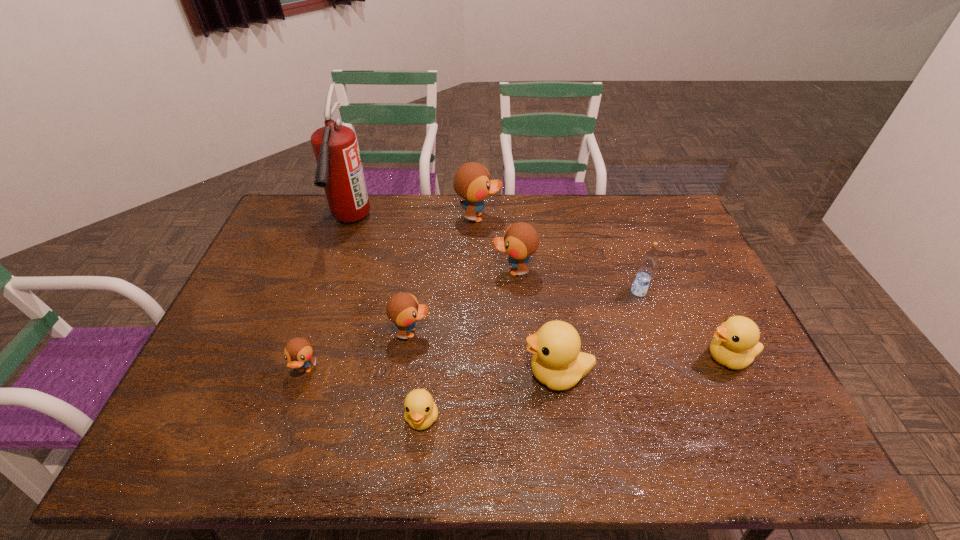
At what (x,y) coordinates should I click in order to perform the action: click on the second blue duck from left to right. Please return your answer as a coordinate pair (x, y). Looking at the image, I should click on (403, 309).

At what (x,y) coordinates should I click in order to perform the action: click on the rightmost object. Please return your answer as a coordinate pair (x, y). Image resolution: width=960 pixels, height=540 pixels. Looking at the image, I should click on (735, 344).

Locate an element on the screen. The width and height of the screenshot is (960, 540). the rightmost duck is located at coordinates (735, 344).

Where is `the smallest blue duck`? The width and height of the screenshot is (960, 540). the smallest blue duck is located at coordinates (298, 352).

This screenshot has height=540, width=960. What are the coordinates of `the leftmost blue duck` in the screenshot? It's located at (298, 352).

Image resolution: width=960 pixels, height=540 pixels. Find the location of `the nearest object`. the nearest object is located at coordinates (421, 411).

This screenshot has width=960, height=540. Find the location of `the leftmost yellow duck`. the leftmost yellow duck is located at coordinates (421, 411).

Where is `vacant space located at the nozzle of the fire extinguisher`? This screenshot has height=540, width=960. vacant space located at the nozzle of the fire extinguisher is located at coordinates (314, 330).

At what (x,y) coordinates should I click in order to perform the action: click on vacant space situated 0.170m on the front-facing side of the tallest duck. Please return your answer as a coordinate pair (x, y). The height and width of the screenshot is (540, 960). Looking at the image, I should click on (548, 217).

Find the location of `vacant region located 0.060m on the right of the sixth nearest object`. vacant region located 0.060m on the right of the sixth nearest object is located at coordinates (666, 292).